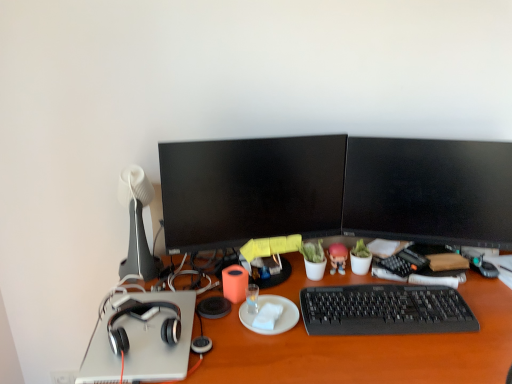
At what (x,y) coordinates should I click in order to perform the action: click on vacant area situated below black matte headphones at left (from a real-world perspective). Please return your answer as a coordinate pair (x, y). The width and height of the screenshot is (512, 384). Looking at the image, I should click on (145, 330).